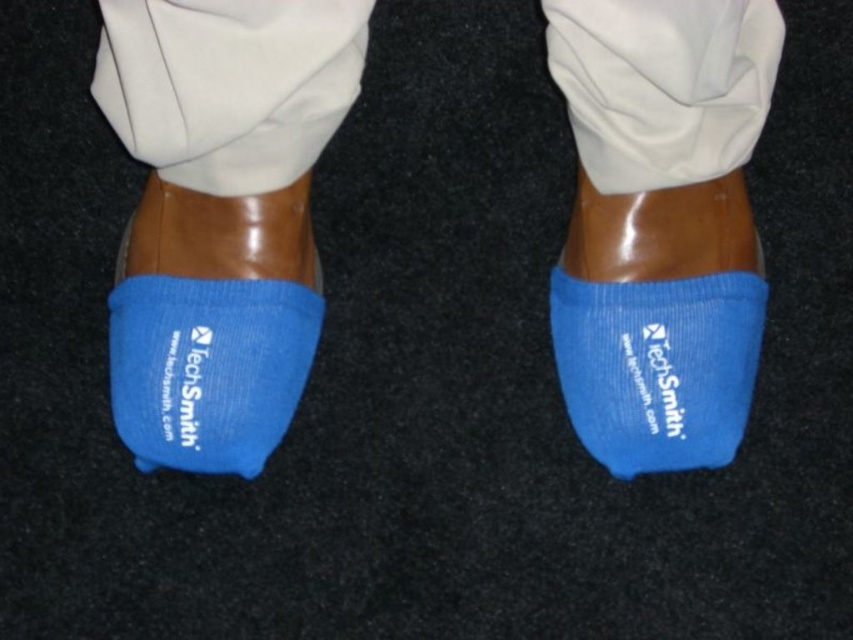
Question: Estimate the real-world distances between objects in this image. Which object is farther from the blue fabric sock at lower left?

Choices:
 (A) blue fabric socks at center
 (B) blue fabric sock at center

Answer: (B)

Question: Where is blue fabric socks at center located in relation to blue fabric sock at center in the image?

Choices:
 (A) left
 (B) right

Answer: (A)

Question: Is blue fabric socks at center to the right of blue fabric sock at center from the viewer's perspective?

Choices:
 (A) no
 (B) yes

Answer: (A)

Question: Is blue fabric socks at center further to camera compared to blue fabric sock at lower left?

Choices:
 (A) no
 (B) yes

Answer: (A)

Question: Among these points, which one is nearest to the camera?

Choices:
 (A) [666, 300]
 (B) [694, 458]
 (C) [299, 362]

Answer: (B)

Question: Estimate the real-world distances between objects in this image. Which object is closer to the blue fabric socks at center?

Choices:
 (A) blue fabric sock at lower left
 (B) blue fabric sock at center

Answer: (A)